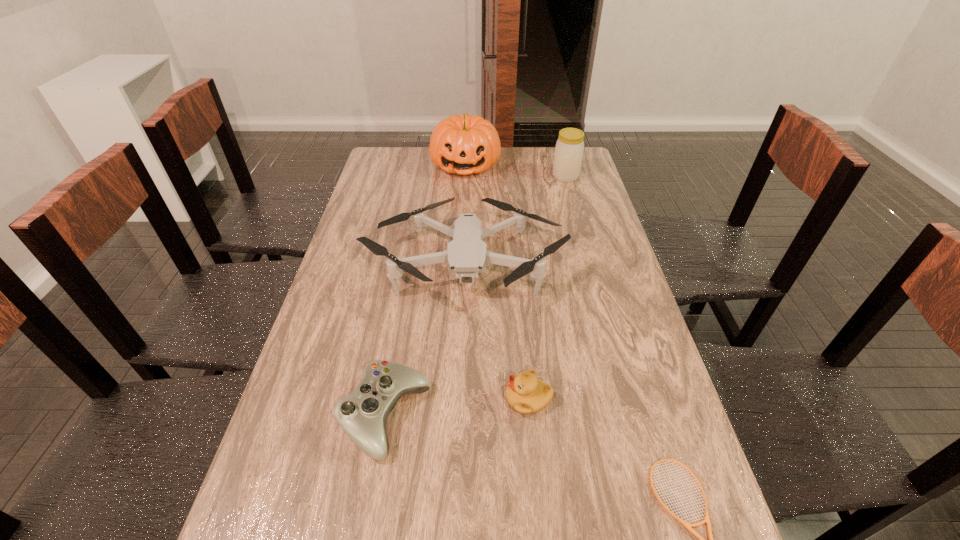
The height and width of the screenshot is (540, 960). What are the coordinates of `vacant space situated 0.240m on the front-facing side of the duckling` in the screenshot? It's located at (397, 399).

Where is `free space located 0.240m on the front-facing side of the duckling`? This screenshot has height=540, width=960. free space located 0.240m on the front-facing side of the duckling is located at coordinates (397, 399).

The width and height of the screenshot is (960, 540). I want to click on free region located on the front-facing side of the duckling, so click(348, 399).

Identify the location of pumpkin that is at the far edge. (465, 144).

Locate an element on the screen. jar at the far edge is located at coordinates (569, 148).

The height and width of the screenshot is (540, 960). In order to click on drone positioned at the left edge in this screenshot , I will do `click(467, 254)`.

The image size is (960, 540). What are the coordinates of `control positioned at the left edge` in the screenshot? It's located at (362, 415).

You are a GUI agent. You are given a task and a screenshot of the screen. Output one action in this format:
    pyautogui.click(x=<x>, y=<y>)
    Task: Click on the object that is positioned at the right edge
    This screenshot has height=540, width=960.
    Given the screenshot: What is the action you would take?
    pyautogui.click(x=569, y=148)

This screenshot has height=540, width=960. I want to click on object located in the far right corner section of the desktop, so click(569, 148).

Where is `free space at the left edge`? The image size is (960, 540). free space at the left edge is located at coordinates (293, 393).